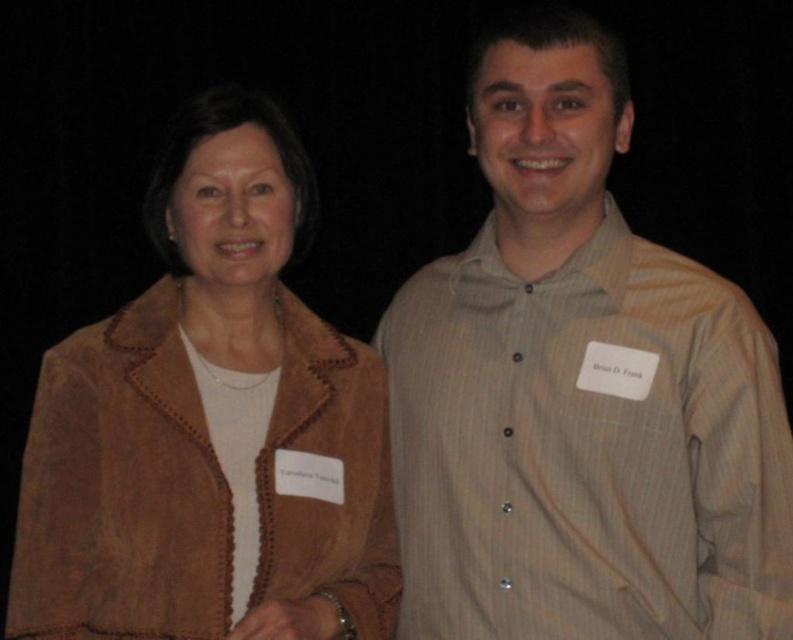
You are a photographer adjusting the lighting for a photoshoot. You notice the light brown striped shirt at center and the suede jacket at left. Which clothing item should you focus on first to ensure proper exposure, considering their position in the frame?

The light brown striped shirt at center is located above the suede jacket at left, so you should focus on the light brown striped shirt at center first to ensure proper exposure since it is higher in the frame.

You are a photographer adjusting the focus of your camera. You notice two points in the image labeled as point 1 and point 2. If point 1 is at coordinate point (749, 593) and point 2 is at coordinate point (159, 552), which point should you focus on to ensure the subject closer to the camera is sharp?

Point 1 at coordinate point (749, 593) should be focused on because it is closer to the camera than point 2 at coordinate point (159, 552).